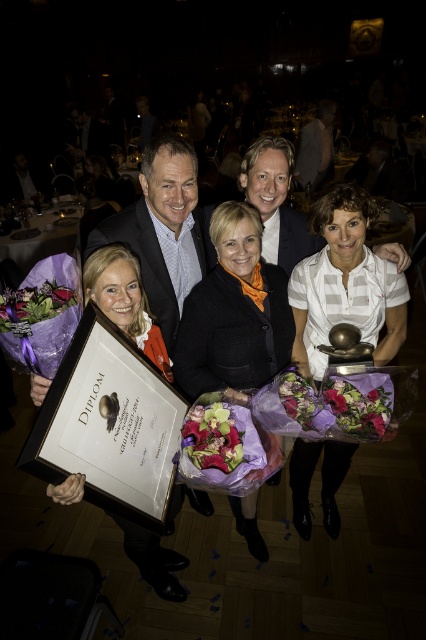
Can you confirm if purple silk bouquet at lower right is positioned to the left of dark blue suit at center?

Yes, purple silk bouquet at lower right is to the left of dark blue suit at center.

Can you confirm if purple silk bouquet at lower right is positioned below dark blue suit at center?

Correct, purple silk bouquet at lower right is located below dark blue suit at center.

Locate an element on the screen. Image resolution: width=426 pixels, height=640 pixels. purple silk bouquet at lower right is located at coordinates (359, 403).

Is dark blue suit at center wider than purple paper flower at lower left?

Correct, the width of dark blue suit at center exceeds that of purple paper flower at lower left.

Does dark blue suit at center have a larger size compared to purple paper flower at lower left?

Indeed, dark blue suit at center has a larger size compared to purple paper flower at lower left.

Is point (334, 106) farther from camera compared to point (49, 305)?

Yes.

Where is `dark blue suit at center`? The width and height of the screenshot is (426, 640). dark blue suit at center is located at coordinates (316, 147).

Between point (299, 333) and point (112, 227), which one is positioned in front?

Point (112, 227) is in front.

This screenshot has width=426, height=640. I want to click on white striped shirt at center, so click(345, 284).